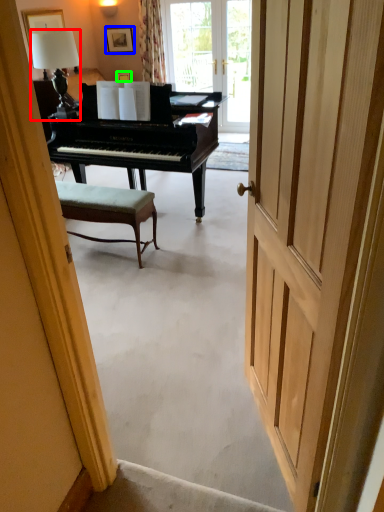
Question: Based on their relative distances, which object is farther from lamp (highlighted by a red box)? Choose from picture frame (highlighted by a blue box) and picture frame (highlighted by a green box).

Choices:
 (A) picture frame
 (B) picture frame

Answer: (A)